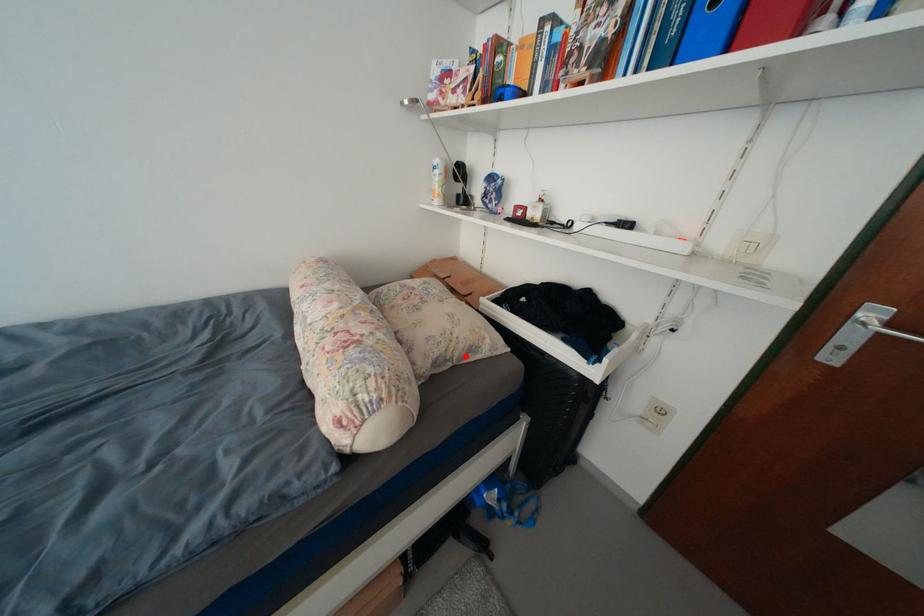
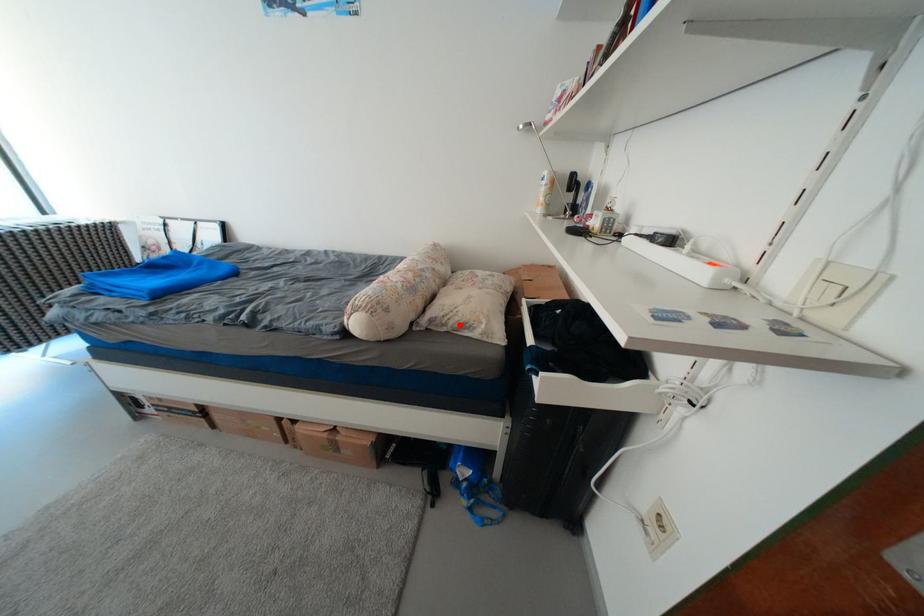
I am providing you with two images of the same scene from different viewpoints. A red point is marked on the first image and another point is marked on the second image. Does the point marked in image1 correspond to the same location as the one in image2?

Yes